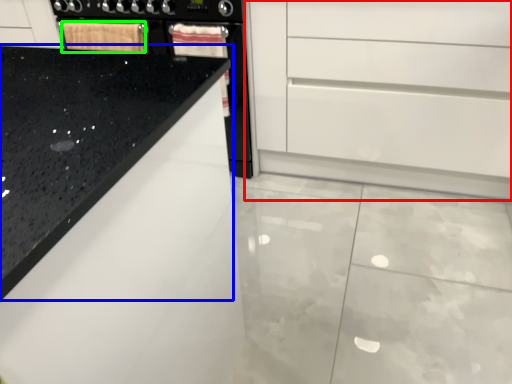
Question: Considering the real-world distances, which object is farthest from chest of drawers (highlighted by a red box)? countertop (highlighted by a blue box) or material (highlighted by a green box)?

Choices:
 (A) countertop
 (B) material

Answer: (A)